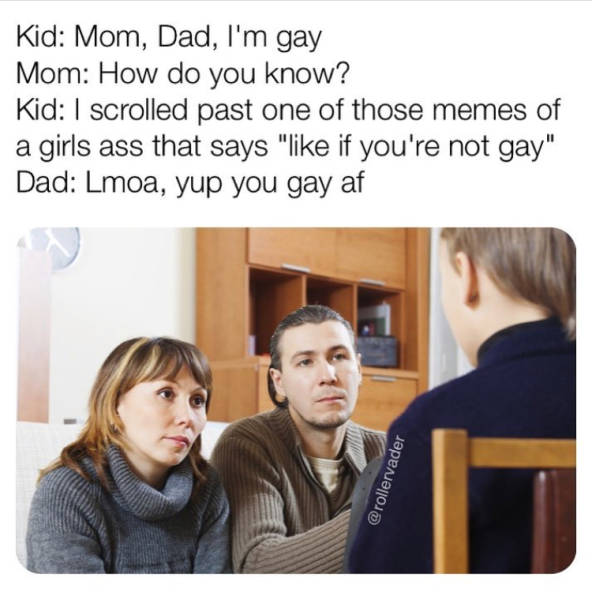
Locate an element on the screen. This screenshot has height=600, width=592. wall is located at coordinates (115, 286).